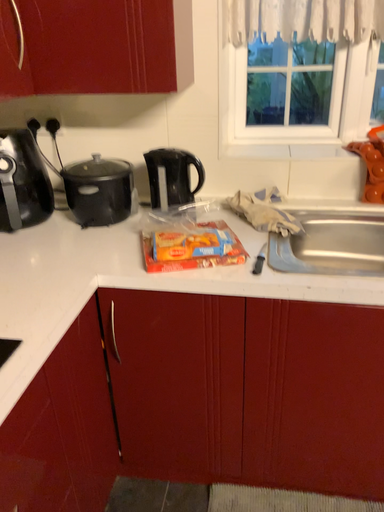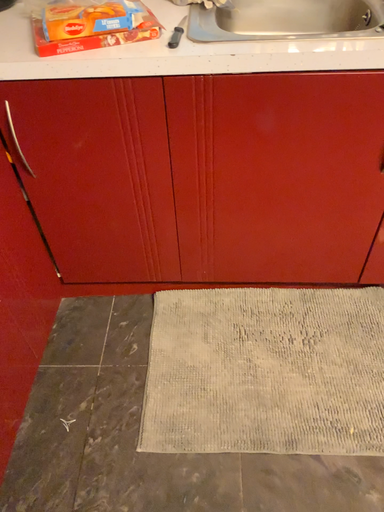
Question: Which way did the camera rotate in the video?

Choices:
 (A) rotated downward
 (B) rotated upward

Answer: (A)